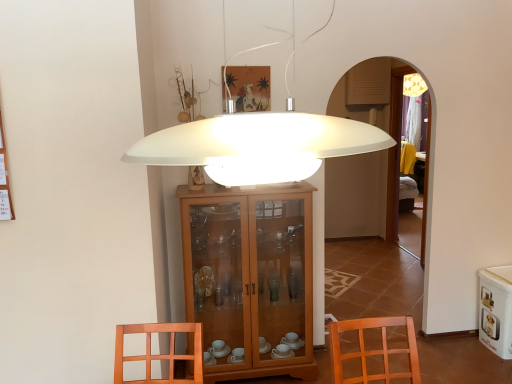
What is the approximate height of matte wooden picture frame at upper center?

matte wooden picture frame at upper center is 15.96 inches tall.

This screenshot has width=512, height=384. What do you see at coordinates (250, 275) in the screenshot?
I see `wooden cabinet at center` at bounding box center [250, 275].

Locate an element on the screen. The height and width of the screenshot is (384, 512). wooden cabinet at center is located at coordinates (250, 275).

What do you see at coordinates (258, 146) in the screenshot?
I see `white matte lampshade at center` at bounding box center [258, 146].

What do you see at coordinates (496, 309) in the screenshot?
I see `white glossy pet food container at lower right` at bounding box center [496, 309].

Where is `matte wooden picture frame at upper center`? The width and height of the screenshot is (512, 384). matte wooden picture frame at upper center is located at coordinates (249, 87).

Which of these two, white matte lampshade at center or white glossy pet food container at lower right, is thinner?

Thinner between the two is white matte lampshade at center.

Are white matte lampshade at center and white glossy pet food container at lower right making contact?

There is a gap between white matte lampshade at center and white glossy pet food container at lower right.

Is white matte lampshade at center at the left side of white glossy pet food container at lower right?

Yes, white matte lampshade at center is to the left of white glossy pet food container at lower right.

What's the angular difference between white matte lampshade at center and white glossy pet food container at lower right's facing directions?

The facing directions of white matte lampshade at center and white glossy pet food container at lower right are 88.6 degrees apart.

Considering the relative sizes of matte wooden picture frame at upper center and white matte lampshade at center in the image provided, is matte wooden picture frame at upper center smaller than white matte lampshade at center?

Correct, matte wooden picture frame at upper center occupies less space than white matte lampshade at center.

From the image's perspective, which is above, matte wooden picture frame at upper center or white matte lampshade at center?

From the image's view, matte wooden picture frame at upper center is above.

From a real-world perspective, between matte wooden picture frame at upper center and white matte lampshade at center, who is vertically higher?

In real-world perspective, matte wooden picture frame at upper center is above.

Is white matte lampshade at center completely or partially inside matte wooden picture frame at upper center?

Definitely not — white matte lampshade at center is not inside matte wooden picture frame at upper center.

Visually, is white glossy pet food container at lower right positioned to the left or to the right of wooden cabinet at center?

Based on their positions, white glossy pet food container at lower right is located to the right of wooden cabinet at center.

From a real-world perspective, is white glossy pet food container at lower right physically located above or below wooden cabinet at center?

In terms of real-world spatial position, white glossy pet food container at lower right is below wooden cabinet at center.

Is white glossy pet food container at lower right taller or shorter than wooden cabinet at center?

In the image, white glossy pet food container at lower right appears to be shorter than wooden cabinet at center.

Considering the points (506, 356) and (284, 295), which point is in front, point (506, 356) or point (284, 295)?

The point (506, 356) is in front.

Is wooden cabinet at center facing towards matte wooden picture frame at upper center?

No.

Relative to matte wooden picture frame at upper center, is wooden cabinet at center in front or behind?

wooden cabinet at center is in front of matte wooden picture frame at upper center.

Is wooden cabinet at center bigger or smaller than matte wooden picture frame at upper center?

Considering their sizes, wooden cabinet at center takes up more space than matte wooden picture frame at upper center.

Considering the sizes of objects wooden cabinet at center and matte wooden picture frame at upper center in the image provided, who is taller, wooden cabinet at center or matte wooden picture frame at upper center?

wooden cabinet at center.

How many degrees apart are the facing directions of white matte lampshade at center and matte wooden picture frame at upper center?

180 degrees separate the facing orientations of white matte lampshade at center and matte wooden picture frame at upper center.

Is white matte lampshade at center beside matte wooden picture frame at upper center?

No, white matte lampshade at center is not making contact with matte wooden picture frame at upper center.

Is white matte lampshade at center at the left side of matte wooden picture frame at upper center?

In fact, white matte lampshade at center is to the right of matte wooden picture frame at upper center.

Is matte wooden picture frame at upper center located within white matte lampshade at center?

Definitely not — matte wooden picture frame at upper center is not inside white matte lampshade at center.

Is white matte lampshade at center taller than wooden cabinet at center?

Incorrect, the height of white matte lampshade at center is not larger of that of wooden cabinet at center.

Does white matte lampshade at center appear on the left side of wooden cabinet at center?

No.

Is the depth of white matte lampshade at center greater than that of wooden cabinet at center?

That is False.

Considering the positions of points (240, 168) and (222, 222), is point (240, 168) farther from camera compared to point (222, 222)?

No, (240, 168) is closer to viewer.

Is wooden cabinet at center touching white glossy pet food container at lower right?

wooden cabinet at center and white glossy pet food container at lower right are clearly separated.

Which of these two, wooden cabinet at center or white glossy pet food container at lower right, is smaller?

With smaller size is white glossy pet food container at lower right.

Between point (210, 216) and point (485, 290), which one is positioned behind?

Positioned behind is point (485, 290).

This screenshot has height=384, width=512. There is a white glossy pet food container at lower right. In order to click on cabinetry above it (from a real-world perspective) in this screenshot , I will do `click(250, 275)`.

Locate an element on the screen. lamp located above the white glossy pet food container at lower right (from a real-world perspective) is located at coordinates (258, 146).

This screenshot has height=384, width=512. In order to click on lamp beneath the matte wooden picture frame at upper center (from a real-world perspective) in this screenshot , I will do `click(258, 146)`.

When comparing their distances from wooden cabinet at center, does white glossy pet food container at lower right or white matte lampshade at center seem closer?

white glossy pet food container at lower right.

Based on their spatial positions, is white glossy pet food container at lower right or matte wooden picture frame at upper center further from wooden cabinet at center?

Among the two, white glossy pet food container at lower right is located further to wooden cabinet at center.

Estimate the real-world distances between objects in this image. Which object is further from white matte lampshade at center, matte wooden picture frame at upper center or white glossy pet food container at lower right?

white glossy pet food container at lower right lies further to white matte lampshade at center than the other object.

Looking at the image, which one is located further to white matte lampshade at center, wooden cabinet at center or matte wooden picture frame at upper center?

wooden cabinet at center lies further to white matte lampshade at center than the other object.

Based on the photo, looking at the image, which one is located closer to white matte lampshade at center, wooden cabinet at center or white glossy pet food container at lower right?

The object closer to white matte lampshade at center is wooden cabinet at center.

Considering their positions, is white glossy pet food container at lower right positioned further to matte wooden picture frame at upper center than wooden cabinet at center?

The object further to matte wooden picture frame at upper center is white glossy pet food container at lower right.

When comparing their distances from matte wooden picture frame at upper center, does wooden cabinet at center or white matte lampshade at center seem closer?

wooden cabinet at center lies closer to matte wooden picture frame at upper center than the other object.

From the image, which object appears to be farther from matte wooden picture frame at upper center, white matte lampshade at center or white glossy pet food container at lower right?

Among the two, white glossy pet food container at lower right is located further to matte wooden picture frame at upper center.

The image size is (512, 384). Identify the location of cabinetry positioned between white matte lampshade at center and matte wooden picture frame at upper center from near to far. (250, 275).

You are a GUI agent. You are given a task and a screenshot of the screen. Output one action in this format:
    pyautogui.click(x=<x>, y=<y>)
    Task: Click on the cabinetry between matte wooden picture frame at upper center and white glossy pet food container at lower right in the horizontal direction
    The height and width of the screenshot is (384, 512).
    Given the screenshot: What is the action you would take?
    pyautogui.click(x=250, y=275)

Identify the location of picture frame located between white matte lampshade at center and white glossy pet food container at lower right in the depth direction. The height and width of the screenshot is (384, 512). (249, 87).

Locate an element on the screen. Image resolution: width=512 pixels, height=384 pixels. cabinetry between white matte lampshade at center and white glossy pet food container at lower right along the z-axis is located at coordinates (250, 275).